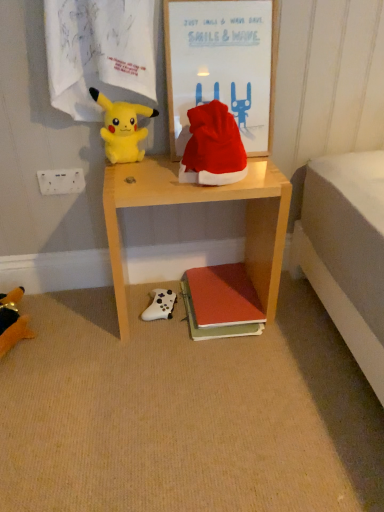
Question: Can you confirm if soft plush toy at lower left, the 3th toy when ordered from top to bottom, is positioned to the left of white matte game controller at lower center, the first toy positioned from the right?

Choices:
 (A) no
 (B) yes

Answer: (B)

Question: Is the depth of soft plush toy at lower left, placed as the first toy when sorted from bottom to top, greater than that of white matte game controller at lower center, the second toy positioned from the top?

Choices:
 (A) yes
 (B) no

Answer: (B)

Question: Is soft plush toy at lower left, placed as the 3th toy when sorted from right to left, taller than white matte game controller at lower center, the second toy positioned from the top?

Choices:
 (A) yes
 (B) no

Answer: (A)

Question: From the image's perspective, would you say soft plush toy at lower left, placed as the 3th toy when sorted from right to left, is shown under white matte game controller at lower center, the first toy positioned from the right?

Choices:
 (A) yes
 (B) no

Answer: (A)

Question: Is soft plush toy at lower left, placed as the 3th toy when sorted from right to left, directly adjacent to white matte game controller at lower center, acting as the third toy starting from the left?

Choices:
 (A) no
 (B) yes

Answer: (A)

Question: Is soft plush toy at lower left, placed as the 3th toy when sorted from right to left, spatially inside matte orange book at lower center, or outside of it?

Choices:
 (A) inside
 (B) outside

Answer: (B)

Question: Does point (9, 308) appear closer or farther from the camera than point (221, 324)?

Choices:
 (A) farther
 (B) closer

Answer: (A)

Question: In the image, is soft plush toy at lower left, placed as the 3th toy when sorted from right to left, positioned in front of or behind matte orange book at lower center?

Choices:
 (A) front
 (B) behind

Answer: (A)

Question: From a real-world perspective, is soft plush toy at lower left, placed as the first toy when sorted from bottom to top, physically located above or below matte orange book at lower center?

Choices:
 (A) above
 (B) below

Answer: (A)

Question: Is point (43, 193) positioned closer to the camera than point (215, 118)?

Choices:
 (A) farther
 (B) closer

Answer: (A)

Question: Would you say white plastic power outlet at upper left is to the left or to the right of red velvet santa hat at center in the picture?

Choices:
 (A) right
 (B) left

Answer: (B)

Question: From a real-world perspective, relative to red velvet santa hat at center, is white plastic power outlet at upper left vertically above or below?

Choices:
 (A) above
 (B) below

Answer: (B)

Question: Is white plastic power outlet at upper left situated inside red velvet santa hat at center or outside?

Choices:
 (A) inside
 (B) outside

Answer: (B)

Question: Based on their positions, is wooden desk at center located to the left or right of wooden framed poster at upper center?

Choices:
 (A) left
 (B) right

Answer: (A)

Question: In the image, is wooden desk at center positioned in front of or behind wooden framed poster at upper center?

Choices:
 (A) front
 (B) behind

Answer: (A)